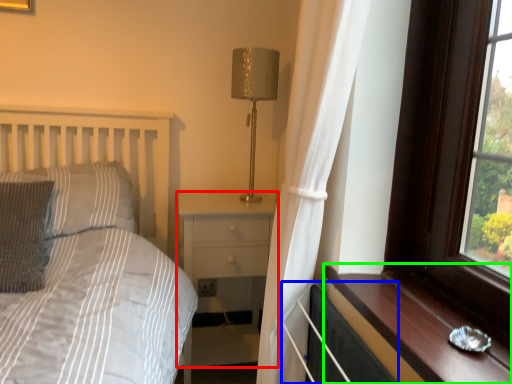
Question: Considering the real-world distances, which object is farthest from nightstand (highlighted by a red box)? radiator (highlighted by a blue box) or window sill (highlighted by a green box)?

Choices:
 (A) radiator
 (B) window sill

Answer: (B)